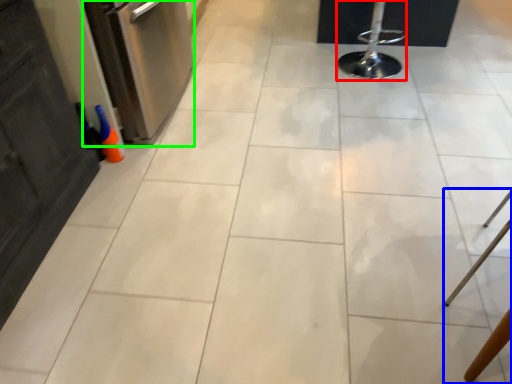
Question: Which is nearer to the bar stool (highlighted by a red box)? furniture (highlighted by a blue box) or dish washer (highlighted by a green box).

Choices:
 (A) furniture
 (B) dish washer

Answer: (B)